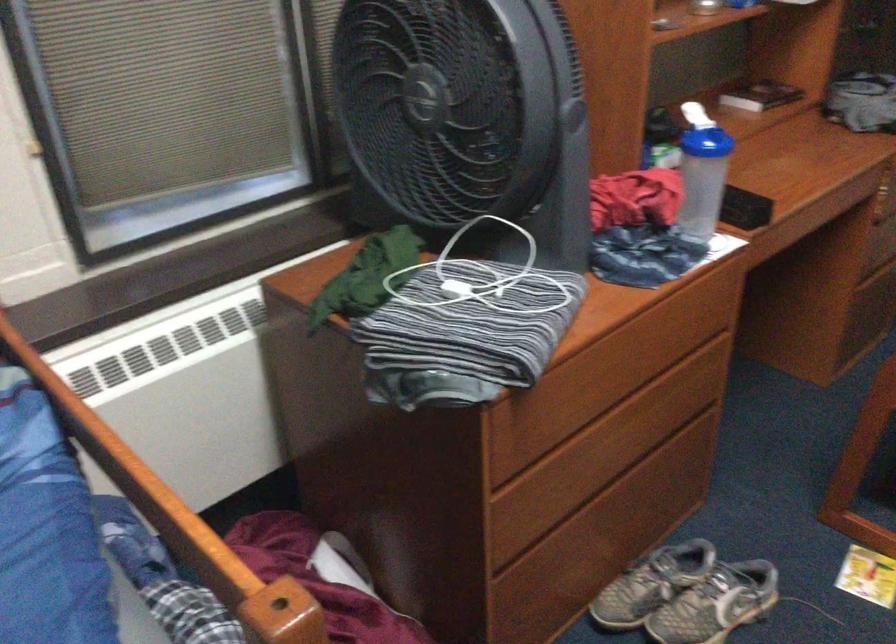
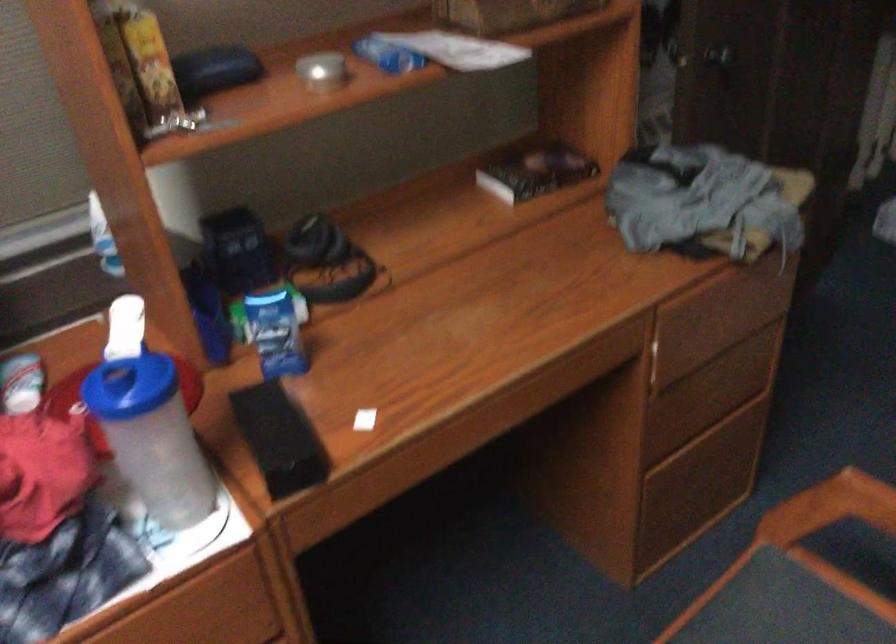
Find the pixel in the second image that matches (724,138) in the first image.

(130, 386)